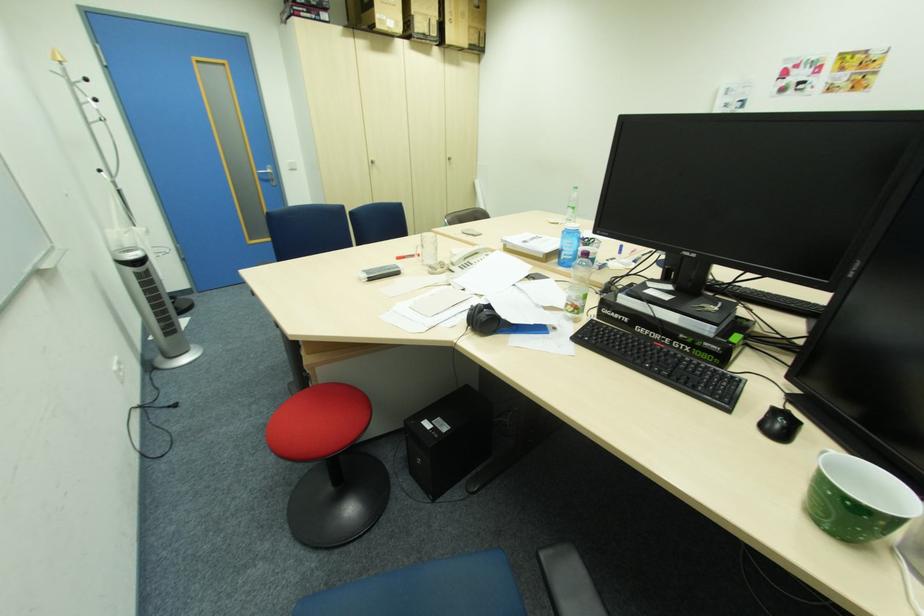
Describe the element at coordinates (56, 57) in the screenshot. Image resolution: width=924 pixels, height=616 pixels. I see `a coat rack hook` at that location.